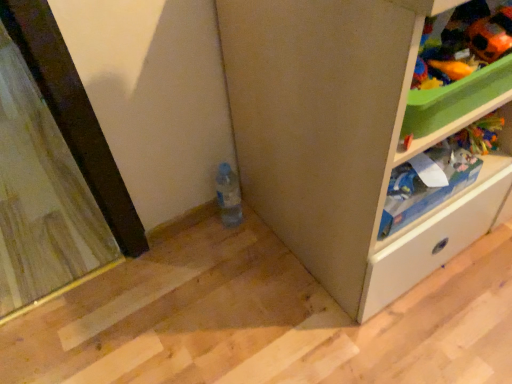
The width and height of the screenshot is (512, 384). I want to click on wooden screen door at left, so click(41, 196).

This screenshot has height=384, width=512. What are the coordinates of `orange plush toy at upper right, acting as the first toy starting from the left` in the screenshot? It's located at (450, 69).

The width and height of the screenshot is (512, 384). Identify the location of white matte cabinet at lower right. (344, 141).

You are a GUI agent. You are given a task and a screenshot of the screen. Output one action in this format:
    pyautogui.click(x=<x>, y=<y>)
    Task: Click on the orange fabric toy at upper right, the 2th toy in the left-to-right sequence
    
    Given the screenshot: What is the action you would take?
    pyautogui.click(x=490, y=35)

From the image's perspective, which one is positioned lower, translucent plastic bottle at lower center or orange plush toy at upper right, acting as the first toy starting from the left?

translucent plastic bottle at lower center appears lower in the image.

Between translucent plastic bottle at lower center and orange plush toy at upper right, the 2th toy when ordered from right to left, which one appears on the right side from the viewer's perspective?

From the viewer's perspective, orange plush toy at upper right, the 2th toy when ordered from right to left, appears more on the right side.

Does translucent plastic bottle at lower center have a lesser height compared to orange plush toy at upper right, acting as the first toy starting from the left?

No.

Is translucent plastic bottle at lower center wider or thinner than orange plush toy at upper right, the 2th toy when ordered from right to left?

translucent plastic bottle at lower center is wider than orange plush toy at upper right, the 2th toy when ordered from right to left.

At what (x,y) coordinates should I click in order to perform the action: click on toy on the right side of orange plush toy at upper right, acting as the first toy starting from the left. Please return your answer as a coordinate pair (x, y). Image resolution: width=512 pixels, height=384 pixels. Looking at the image, I should click on (490, 35).

How different are the orientations of orange fabric toy at upper right, acting as the 1th toy starting from the right, and orange plush toy at upper right, acting as the first toy starting from the left, in degrees?

orange fabric toy at upper right, acting as the 1th toy starting from the right, and orange plush toy at upper right, acting as the first toy starting from the left, are facing 0.00665 degrees away from each other.

Does orange fabric toy at upper right, the 2th toy in the left-to-right sequence, have a greater width compared to orange plush toy at upper right, the 2th toy when ordered from right to left?

Yes.

Are orange fabric toy at upper right, acting as the 1th toy starting from the right, and orange plush toy at upper right, acting as the first toy starting from the left, beside each other?

Indeed, orange fabric toy at upper right, acting as the 1th toy starting from the right, and orange plush toy at upper right, acting as the first toy starting from the left, are beside each other and touching.

Can you confirm if orange fabric toy at upper right, acting as the 1th toy starting from the right, is positioned to the left of wooden screen door at left?

No.

From the image's perspective, is orange fabric toy at upper right, the 2th toy in the left-to-right sequence, located beneath wooden screen door at left?

Yes, from the image's perspective, orange fabric toy at upper right, the 2th toy in the left-to-right sequence, is beneath wooden screen door at left.

Considering the relative sizes of orange fabric toy at upper right, the 2th toy in the left-to-right sequence, and wooden screen door at left in the image provided, is orange fabric toy at upper right, the 2th toy in the left-to-right sequence, wider than wooden screen door at left?

Incorrect, the width of orange fabric toy at upper right, the 2th toy in the left-to-right sequence, does not surpass that of wooden screen door at left.

Is orange fabric toy at upper right, acting as the 1th toy starting from the right, looking in the opposite direction of wooden screen door at left?

That's not correct — orange fabric toy at upper right, acting as the 1th toy starting from the right, is not looking away from wooden screen door at left.

Does point (477, 203) come farther from viewer compared to point (502, 6)?

Yes, it is behind point (502, 6).

Considering the positions of objects white matte cabinet at lower right and orange fabric toy at upper right, acting as the 1th toy starting from the right, in the image provided, who is in front, white matte cabinet at lower right or orange fabric toy at upper right, acting as the 1th toy starting from the right,?

white matte cabinet at lower right is more forward.

Based on the photo, from the image's perspective, which one is positioned higher, white matte cabinet at lower right or orange fabric toy at upper right, the 2th toy in the left-to-right sequence?

From the image's view, white matte cabinet at lower right is above.

Is white matte cabinet at lower right spatially inside orange fabric toy at upper right, acting as the 1th toy starting from the right, or outside of it?

white matte cabinet at lower right is located beyond the bounds of orange fabric toy at upper right, acting as the 1th toy starting from the right.

Considering the sizes of white plastic shelf at upper right and wooden screen door at left in the image, is white plastic shelf at upper right wider or thinner than wooden screen door at left?

white plastic shelf at upper right is thinner than wooden screen door at left.

Which point is more forward, (386, 240) or (44, 125)?

Point (386, 240)

Can you confirm if white plastic shelf at upper right is bigger than wooden screen door at left?

No, white plastic shelf at upper right is not bigger than wooden screen door at left.

Would you say white plastic shelf at upper right is inside or outside wooden screen door at left?

white plastic shelf at upper right exists outside the volume of wooden screen door at left.

Between point (218, 182) and point (7, 80), which one is positioned in front?

The point (218, 182) is closer to the camera.

From a real-world perspective, which object rests below the other?

From a 3D spatial view, wooden screen door at left is below.

Does translucent plastic bottle at lower center have a lesser height compared to wooden screen door at left?

Incorrect, the height of translucent plastic bottle at lower center does not fall short of that of wooden screen door at left.

Locate an element on the screen. Image resolution: width=512 pixels, height=384 pixels. screen door that appears below the translucent plastic bottle at lower center (from a real-world perspective) is located at coordinates (41, 196).

Where is `shelf to the right of wooden screen door at left`? The width and height of the screenshot is (512, 384). shelf to the right of wooden screen door at left is located at coordinates (417, 222).

From the image's perspective, between wooden screen door at left and white plastic shelf at upper right, which one is located above?

wooden screen door at left appears higher in the image.

Between wooden screen door at left and white plastic shelf at upper right, which one is positioned behind?

wooden screen door at left is further from the camera.

Locate an element on the screen. The width and height of the screenshot is (512, 384). bottle to the left of orange plush toy at upper right, acting as the first toy starting from the left is located at coordinates (228, 195).

I want to click on toy directly beneath the orange fabric toy at upper right, the 2th toy in the left-to-right sequence (from a real-world perspective), so click(450, 69).

From the image, which object appears to be nearer to orange plush toy at upper right, the 2th toy when ordered from right to left, translucent plastic bottle at lower center or orange fabric toy at upper right, the 2th toy in the left-to-right sequence?

orange fabric toy at upper right, the 2th toy in the left-to-right sequence.

Estimate the real-world distances between objects in this image. Which object is closer to wooden screen door at left, orange plush toy at upper right, acting as the first toy starting from the left, or white matte cabinet at lower right?

white matte cabinet at lower right is closer to wooden screen door at left.

Estimate the real-world distances between objects in this image. Which object is further from white plastic shelf at upper right, orange fabric toy at upper right, acting as the 1th toy starting from the right, or wooden screen door at left?

The object further to white plastic shelf at upper right is wooden screen door at left.

Considering their positions, is white matte cabinet at lower right positioned closer to orange plush toy at upper right, the 2th toy when ordered from right to left, than translucent plastic bottle at lower center?

Answer: white matte cabinet at lower right lies closer to orange plush toy at upper right, the 2th toy when ordered from right to left, than the other object.

From the image, which object appears to be farther from orange plush toy at upper right, the 2th toy when ordered from right to left, white matte cabinet at lower right or white plastic shelf at upper right?

Based on the image, white matte cabinet at lower right appears to be further to orange plush toy at upper right, the 2th toy when ordered from right to left.

Looking at the image, which one is located further to white plastic shelf at upper right, orange plush toy at upper right, acting as the first toy starting from the left, or translucent plastic bottle at lower center?

translucent plastic bottle at lower center is further to white plastic shelf at upper right.

Considering their positions, is white matte cabinet at lower right positioned further to translucent plastic bottle at lower center than orange fabric toy at upper right, the 2th toy in the left-to-right sequence?

The object further to translucent plastic bottle at lower center is orange fabric toy at upper right, the 2th toy in the left-to-right sequence.

Based on their spatial positions, is white plastic shelf at upper right or translucent plastic bottle at lower center closer to white matte cabinet at lower right?

white plastic shelf at upper right.

Where is `toy between translucent plastic bottle at lower center and orange fabric toy at upper right, acting as the 1th toy starting from the right, from left to right`? Image resolution: width=512 pixels, height=384 pixels. toy between translucent plastic bottle at lower center and orange fabric toy at upper right, acting as the 1th toy starting from the right, from left to right is located at coordinates (450, 69).

The image size is (512, 384). What are the coordinates of `bottle between wooden screen door at left and orange plush toy at upper right, the 2th toy when ordered from right to left` in the screenshot? It's located at (x=228, y=195).

Locate an element on the screen. Image resolution: width=512 pixels, height=384 pixels. shelf between white matte cabinet at lower right and translucent plastic bottle at lower center in the front-back direction is located at coordinates (417, 222).

Identify the location of toy located between translucent plastic bottle at lower center and white plastic shelf at upper right in the left-right direction. Image resolution: width=512 pixels, height=384 pixels. (450, 69).